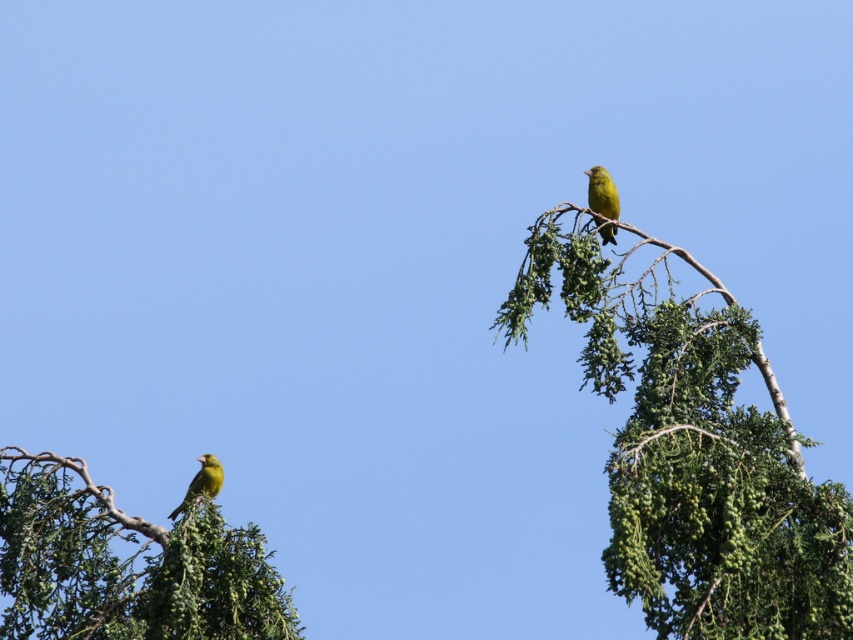
Question: Which point is closer to the camera?

Choices:
 (A) click(207, 464)
 (B) click(604, 234)
 (C) click(241, 588)

Answer: (C)

Question: Can you confirm if green leafy branch at upper right is bigger than bright yellow bird at upper right?

Choices:
 (A) yes
 (B) no

Answer: (A)

Question: Does green leafy branch at upper right lie in front of green leafy branch at lower left?

Choices:
 (A) no
 (B) yes

Answer: (B)

Question: Can you confirm if green leafy branch at upper right is wider than green leafy branch at lower left?

Choices:
 (A) yes
 (B) no

Answer: (A)

Question: Among these objects, which one is farthest from the camera?

Choices:
 (A) green leafy branch at upper right
 (B) bright yellow bird at upper right
 (C) shiny green bird at upper left
 (D) green leafy branch at lower left

Answer: (D)

Question: Which object appears farthest from the camera in this image?

Choices:
 (A) green leafy branch at lower left
 (B) shiny green bird at upper left
 (C) bright yellow bird at upper right
 (D) green leafy branch at upper right

Answer: (A)